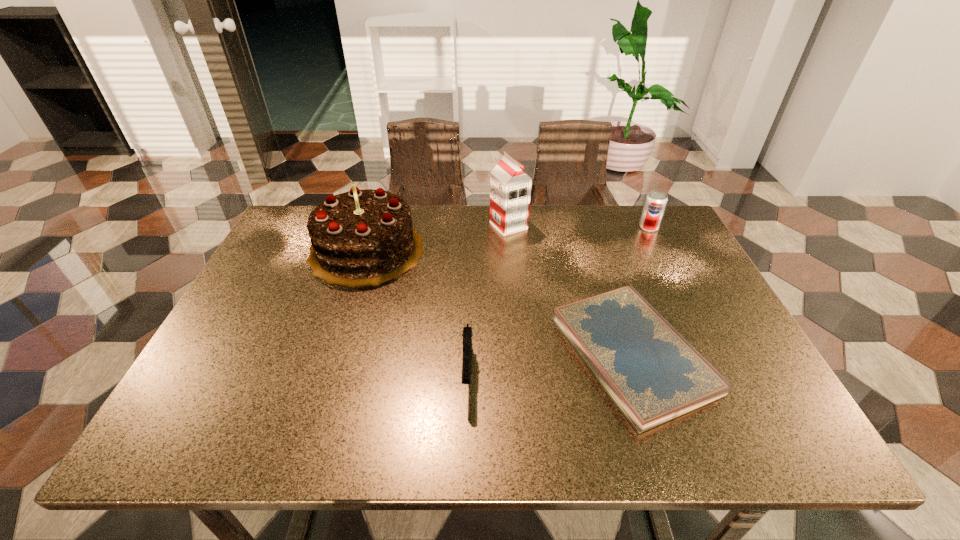
I want to click on free space between the leftmost object and the shortest object, so click(x=499, y=302).

This screenshot has width=960, height=540. In order to click on vacant area between the fourth tallest object and the leftmost object in this screenshot , I will do `click(417, 311)`.

Locate an element on the screen. This screenshot has height=540, width=960. vacant space in between the shortest object and the soda is located at coordinates (640, 291).

Find the location of a particular element. The height and width of the screenshot is (540, 960). free spot between the leftmost object and the soya milk is located at coordinates (438, 238).

This screenshot has width=960, height=540. Identify the location of object that is the third closest to the birthday cake. (652, 373).

Identify which object is the third nearest to the third shortest object. Please provide its 2D coordinates. Your answer should be formatted as a tuple, i.e. [(x, y)], where the tuple contains the x and y coordinates of a point satisfying the conditions above.

[(365, 237)]

Where is `vacant point that satisfies the following two spatial constraints: 1. on the front side of the third shortest object; 2. on the right side of the third object from left to right`? vacant point that satisfies the following two spatial constraints: 1. on the front side of the third shortest object; 2. on the right side of the third object from left to right is located at coordinates (509, 227).

Locate an element on the screen. This screenshot has height=540, width=960. free location that satisfies the following two spatial constraints: 1. on the front side of the third tallest object; 2. on the left side of the third object from right to left is located at coordinates (509, 227).